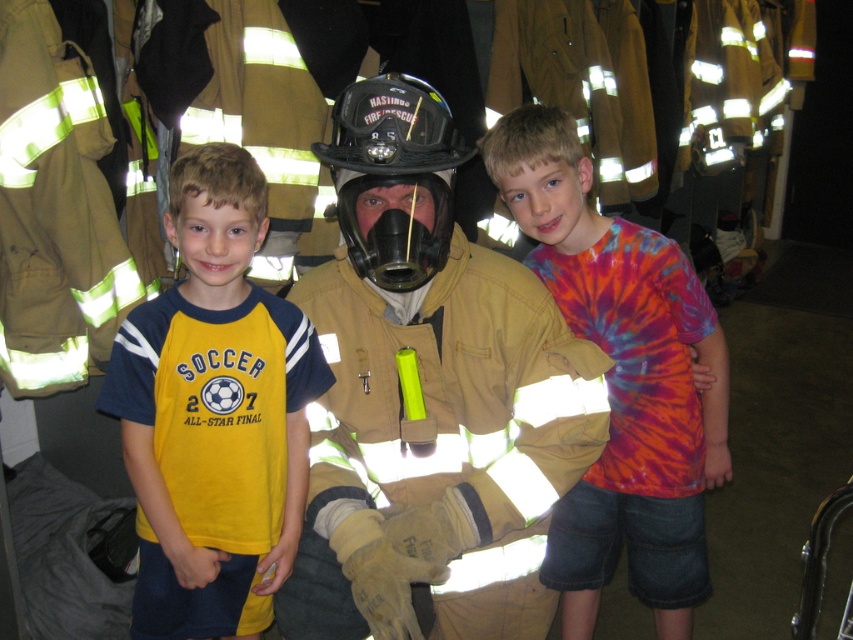
Is matte yellow fireman at center closer to the viewer compared to black matte helmet at center?

Yes, matte yellow fireman at center is in front of black matte helmet at center.

Is matte yellow fireman at center taller than black matte helmet at center?

Correct, matte yellow fireman at center is much taller as black matte helmet at center.

Does point (456, 408) lie behind point (469, 156)?

That is True.

I want to click on matte yellow fireman at center, so click(430, 400).

Who is more forward, (170, 518) or (412, 246)?

Point (412, 246) is more forward.

Who is taller, yellow fabric shirt at left or black matte helmet at center?

yellow fabric shirt at left

Image resolution: width=853 pixels, height=640 pixels. Describe the element at coordinates (213, 413) in the screenshot. I see `yellow fabric shirt at left` at that location.

Find the location of a particular element. yellow fabric shirt at left is located at coordinates (213, 413).

Which is above, matte yellow fireman at center or tie-dye fabric shirt at center?

matte yellow fireman at center is higher up.

Between matte yellow fireman at center and tie-dye fabric shirt at center, which one appears on the right side from the viewer's perspective?

From the viewer's perspective, tie-dye fabric shirt at center appears more on the right side.

Locate an element on the screen. The image size is (853, 640). matte yellow fireman at center is located at coordinates (430, 400).

At what (x,y) coordinates should I click in order to perform the action: click on matte yellow fireman at center. Please return your answer as a coordinate pair (x, y). The image size is (853, 640). Looking at the image, I should click on (430, 400).